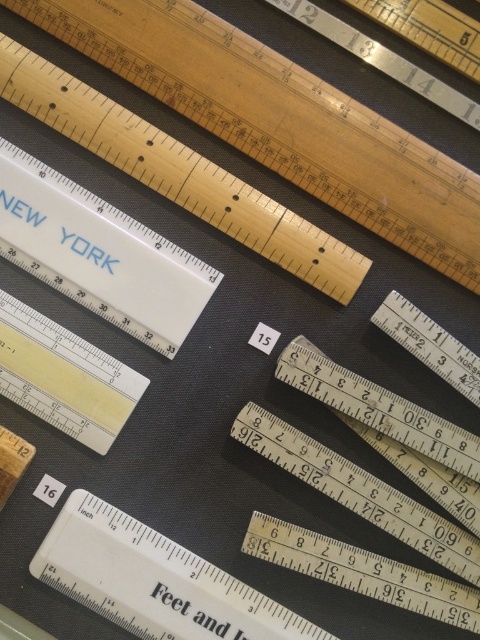
Is point (159, 557) more distant than point (387, 584)?

Yes, it is behind point (387, 584).

Is white plastic ruler at lower center positioned behind wooden ruler at center?

No, it is not.

The width and height of the screenshot is (480, 640). I want to click on white plastic ruler at lower center, so click(x=154, y=580).

Is white plastic ruler at upper left to the right of wooden ruler at center from the viewer's perspective?

No, white plastic ruler at upper left is not to the right of wooden ruler at center.

What do you see at coordinates (98, 253) in the screenshot? The height and width of the screenshot is (640, 480). I see `white plastic ruler at upper left` at bounding box center [98, 253].

Identify the location of white plastic ruler at upper left. This screenshot has width=480, height=640. [x=98, y=253].

Is white plastic ruler at upper left smaller than yellow matte ruler at center?

Actually, white plastic ruler at upper left might be larger than yellow matte ruler at center.

What do you see at coordinates (98, 253) in the screenshot?
I see `white plastic ruler at upper left` at bounding box center [98, 253].

You are a GUI agent. You are given a task and a screenshot of the screen. Output one action in this format:
    pyautogui.click(x=<x>, y=<y>)
    Task: Click on the white plastic ruler at upper left
    The width and height of the screenshot is (480, 640).
    Given the screenshot: What is the action you would take?
    pyautogui.click(x=98, y=253)

Find the location of a particular element. white plastic ruler at upper left is located at coordinates click(x=98, y=253).